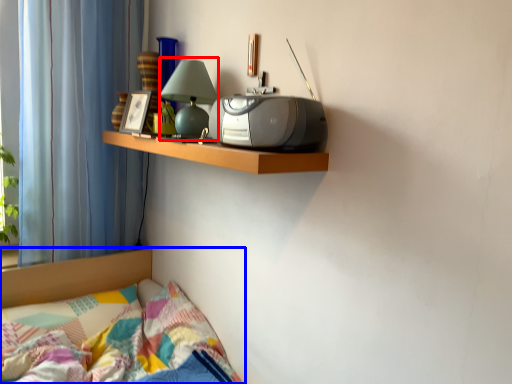
Question: Which point is further to the camera, table lamp (highlighted by a red box) or bed (highlighted by a blue box)?

Choices:
 (A) table lamp
 (B) bed

Answer: (A)